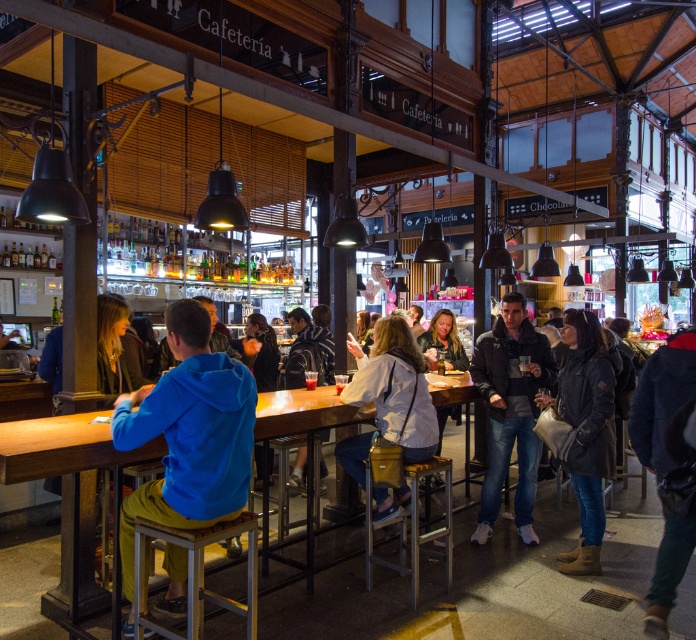
You are a customer in the cafe and want to sit on the metal stool at the counter. However, there is a denim jacket at lower right near the point marked at coordinate (661, 397). Will this jacket interfere with your ability to sit comfortably on the metal stool at the counter?

The point (661, 397) is on the denim jacket at lower right, so the denim jacket at lower right is located near the metal stool at the counter. This may interfere with sitting comfortably as the jacket is positioned near the stool.